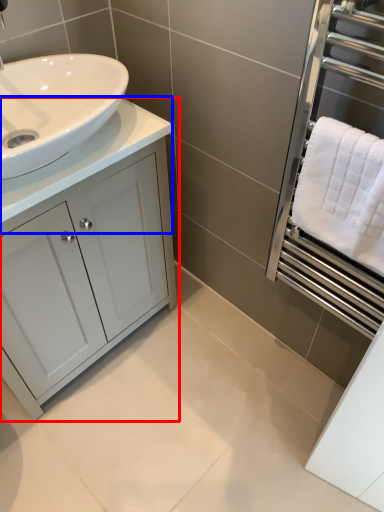
Question: Which point is further to the camera, bathroom cabinet (highlighted by a red box) or counter top (highlighted by a blue box)?

Choices:
 (A) bathroom cabinet
 (B) counter top

Answer: (A)